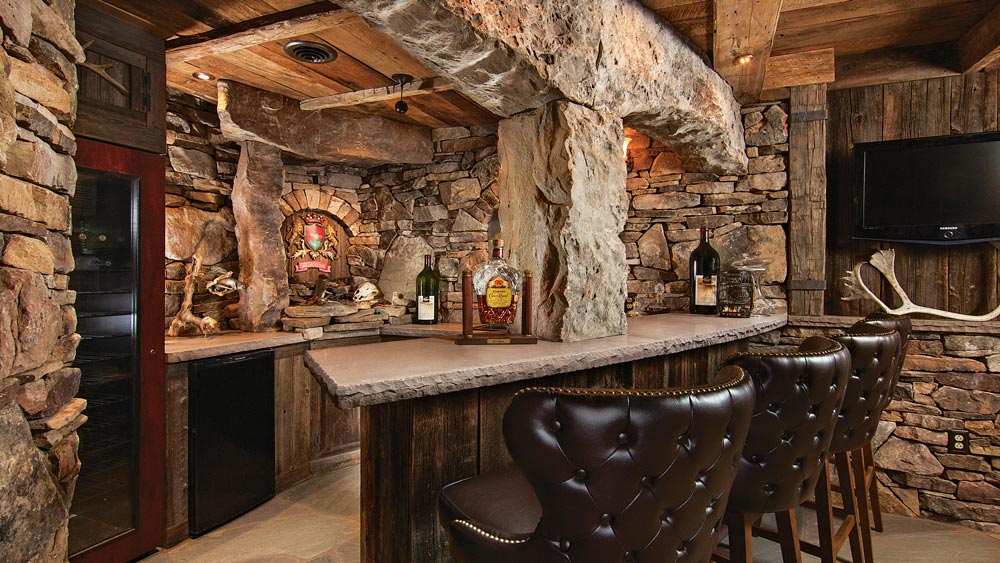
Identify the location of bottles. Image resolution: width=1000 pixels, height=563 pixels. (496, 288), (706, 251).